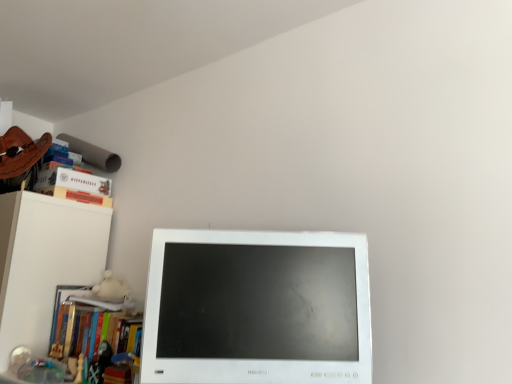
Question: Can hardcover book at upper left, which is counted as the first paperback book, starting from the bottom, be found inside wooden chess piece at lower left?

Choices:
 (A) no
 (B) yes

Answer: (A)

Question: Is the depth of wooden chess piece at lower left greater than that of hardcover book at upper left, which is counted as the second paperback book, starting from the top?

Choices:
 (A) yes
 (B) no

Answer: (B)

Question: Is wooden chess piece at lower left oriented towards hardcover book at upper left, which is counted as the first paperback book, starting from the bottom?

Choices:
 (A) yes
 (B) no

Answer: (B)

Question: Is wooden chess piece at lower left shorter than hardcover book at upper left, which is counted as the second paperback book, starting from the top?

Choices:
 (A) no
 (B) yes

Answer: (A)

Question: From the image's perspective, is wooden chess piece at lower left under hardcover book at upper left, which is counted as the second paperback book, starting from the top?

Choices:
 (A) no
 (B) yes

Answer: (B)

Question: Is point (109, 304) positioned closer to the camera than point (55, 168)?

Choices:
 (A) farther
 (B) closer

Answer: (B)

Question: Visually, is white matte book at lower left, arranged as the first book when viewed from the top, positioned to the left or to the right of hardcover book at upper left, arranged as the 2th paperback book when ordered from the bottom?

Choices:
 (A) left
 (B) right

Answer: (B)

Question: Is white matte book at lower left, arranged as the first book when viewed from the top, in front of or behind hardcover book at upper left, arranged as the 2th paperback book when ordered from the bottom, in the image?

Choices:
 (A) behind
 (B) front

Answer: (B)

Question: In terms of size, does white matte book at lower left, arranged as the first book when viewed from the top, appear bigger or smaller than hardcover book at upper left, the 1th paperback book viewed from the top?

Choices:
 (A) big
 (B) small

Answer: (B)

Question: Is white matte book at lower left, marked as the 2th book in a bottom-to-top arrangement, wider or thinner than wooden chess piece at lower left?

Choices:
 (A) wide
 (B) thin

Answer: (A)

Question: Relative to wooden chess piece at lower left, is white matte book at lower left, marked as the 2th book in a bottom-to-top arrangement, in front or behind?

Choices:
 (A) front
 (B) behind

Answer: (B)

Question: From the image's perspective, relative to wooden chess piece at lower left, is white matte book at lower left, arranged as the first book when viewed from the top, above or below?

Choices:
 (A) above
 (B) below

Answer: (A)

Question: Is white matte book at lower left, arranged as the first book when viewed from the top, inside the boundaries of wooden chess piece at lower left, or outside?

Choices:
 (A) inside
 (B) outside

Answer: (B)

Question: In terms of width, does hardcover book at upper left, which is counted as the second paperback book, starting from the top, look wider or thinner when compared to white glossy computer monitor at center?

Choices:
 (A) wide
 (B) thin

Answer: (A)

Question: From the image's perspective, is hardcover book at upper left, which is counted as the first paperback book, starting from the bottom, above or below white glossy computer monitor at center?

Choices:
 (A) above
 (B) below

Answer: (A)